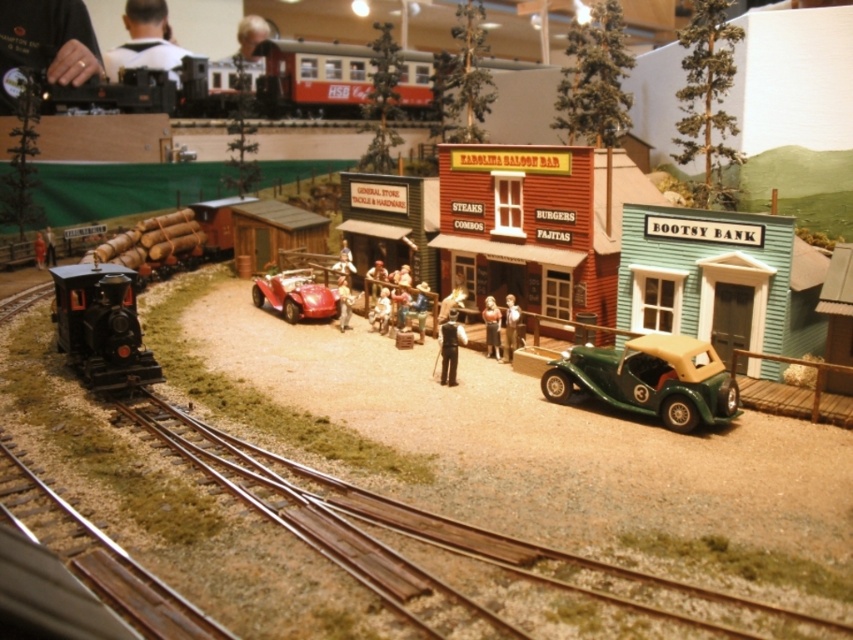
You are a model train engineer navigating the miniature diorama scene. You need to determine the correct path for your train. If you are currently at the point labeled point (404, 52), which direction should you head to reach the point labeled point (305, 285)?

Since point (404, 52) is behind point (305, 285), you should move forward towards the direction of point (305, 285) to reach it.

You are a model train enthusiast who wants to place a new toy car in the diorama. The green matte toy car at center is currently in the town square. If you want to place a toy car that is shorter than the brushed metal train at upper center, where should you place it?

The green matte toy car at center is shorter than the brushed metal train at upper center, so placing it in the town square where the green matte toy car at center is located would ensure it is shorter than the brushed metal train at upper center.